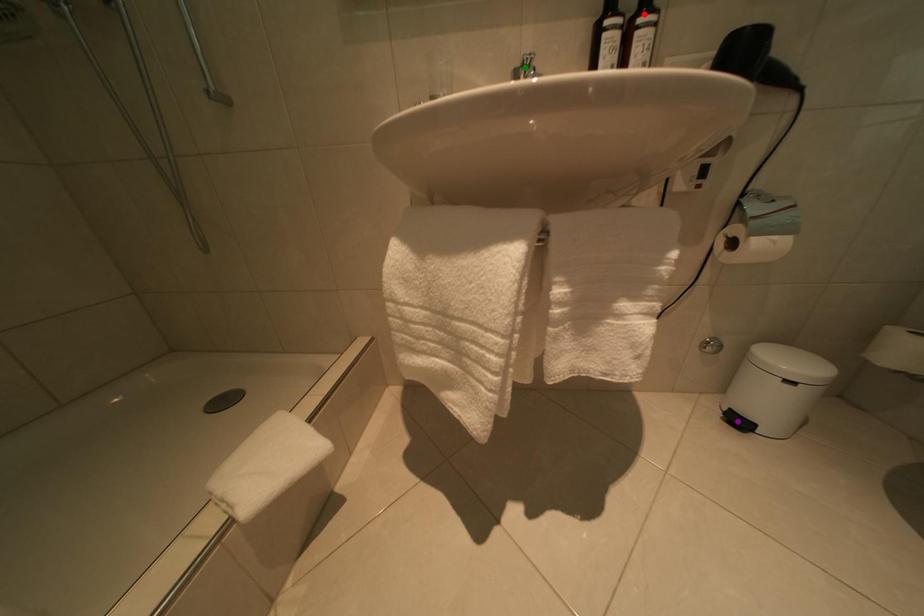
Order these from nearest to farthest:
purple point, green point, red point

purple point, red point, green point